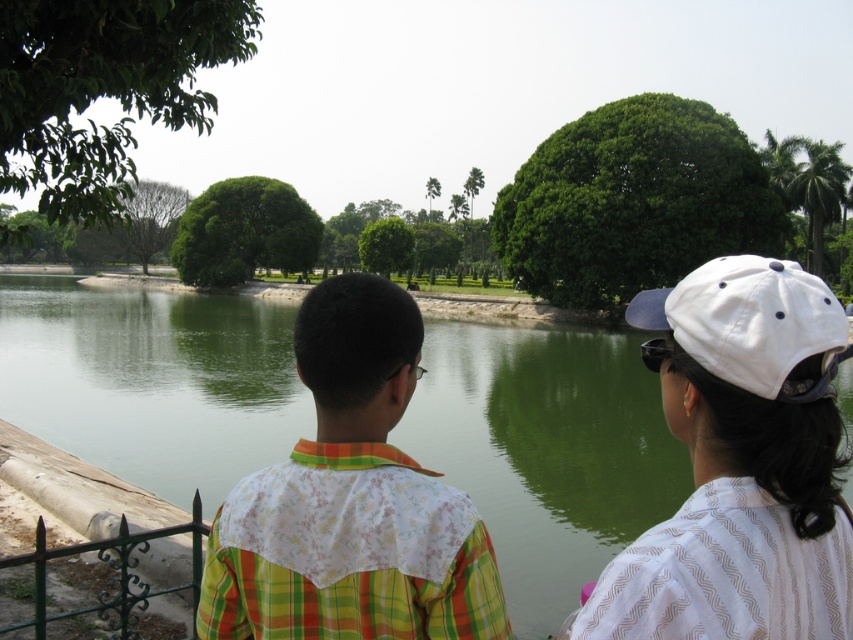
Looking at this image, which is below, white fabric cap at upper right or white fabric baseball cap at upper right?

Positioned lower is white fabric cap at upper right.

Is white fabric cap at upper right above white fabric baseball cap at upper right?

Actually, white fabric cap at upper right is below white fabric baseball cap at upper right.

This screenshot has width=853, height=640. What are the coordinates of `white fabric cap at upper right` in the screenshot? It's located at (740, 465).

Which is in front, point (428, 532) or point (80, 547)?

Positioned in front is point (428, 532).

Does point (433, 552) come in front of point (115, 589)?

Yes, it is.

Where is `floral fabric shirt at center`? This screenshot has height=640, width=853. floral fabric shirt at center is located at coordinates (351, 500).

From the picture: Is green liquid water at center positioned in front of green wrought iron fence at lower left?

Yes, it is in front of green wrought iron fence at lower left.

Can you confirm if green liquid water at center is positioned below green wrought iron fence at lower left?

Actually, green liquid water at center is above green wrought iron fence at lower left.

Does point (555, 404) lie behind point (125, 531)?

That is True.

Locate an element on the screen. The width and height of the screenshot is (853, 640). green liquid water at center is located at coordinates (546, 451).